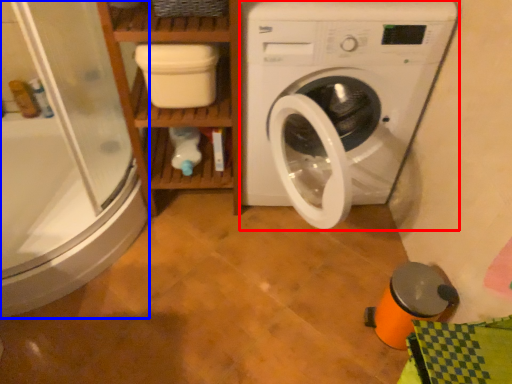
Question: Which point is further to the camera, washing machine (highlighted by a red box) or shower door (highlighted by a blue box)?

Choices:
 (A) washing machine
 (B) shower door

Answer: (A)